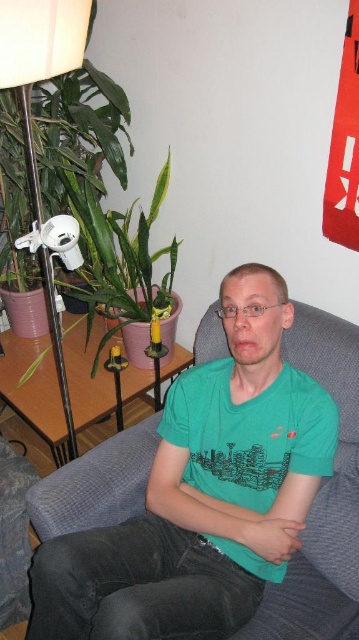
From the picture: You are a delivery person entering the room and need to place a package on the floor near the green leafy plant at left and the fuzzy fabric couch at lower left. Where should you place the package so it is closest to both objects?

The green leafy plant at left is above the fuzzy fabric couch at lower left, so placing the package near the base of the green leafy plant at left would be closest to both objects.

You are trying to decide where to place a new small potted plant in the living room. The green leafy plant at left and the fuzzy fabric couch at lower left are already present. Which existing object should you place the new plant closer to if you want it to be smaller in size compared to the existing objects?

The green leafy plant at left is bigger than the fuzzy fabric couch at lower left. To have the new plant be smaller in size compared to existing objects, place it closer to the fuzzy fabric couch at lower left since it is smaller.